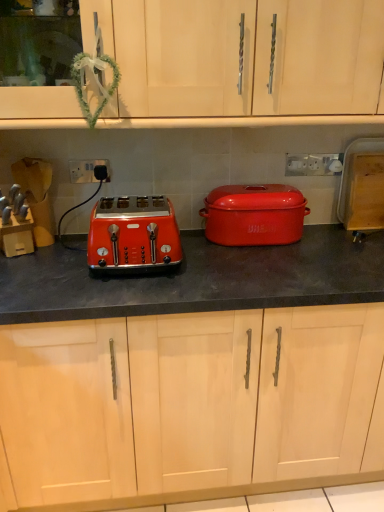
At what (x,y) coordinates should I click in order to perform the action: click on free space to the right of matte orange toaster at left. Please return your answer as a coordinate pair (x, y). The width and height of the screenshot is (384, 512). Looking at the image, I should click on (228, 266).